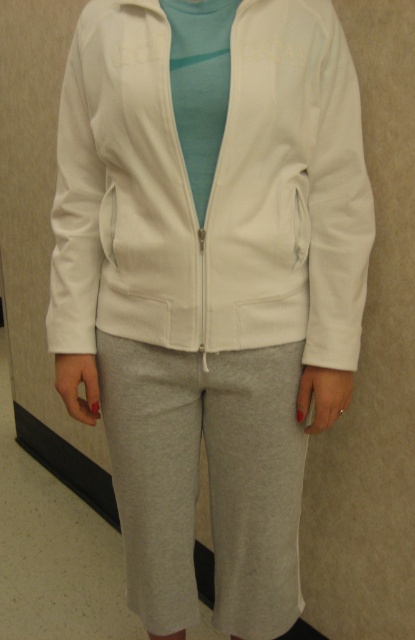
Question: Among these points, which one is farthest from the camera?

Choices:
 (A) (292, 284)
 (B) (183, 452)

Answer: (B)

Question: Is white smooth zip-up jacket at center closer to camera compared to gray cotton pants at center?

Choices:
 (A) no
 (B) yes

Answer: (B)

Question: Is white smooth zip-up jacket at center closer to the viewer compared to gray cotton pants at center?

Choices:
 (A) yes
 (B) no

Answer: (A)

Question: Which of the following is the closest to the observer?

Choices:
 (A) (214, 467)
 (B) (129, 138)

Answer: (B)

Question: Can you confirm if white smooth zip-up jacket at center is positioned to the left of gray cotton pants at center?

Choices:
 (A) no
 (B) yes

Answer: (B)

Question: Among these objects, which one is farthest from the camera?

Choices:
 (A) gray cotton pants at center
 (B) white smooth zip-up jacket at center

Answer: (A)